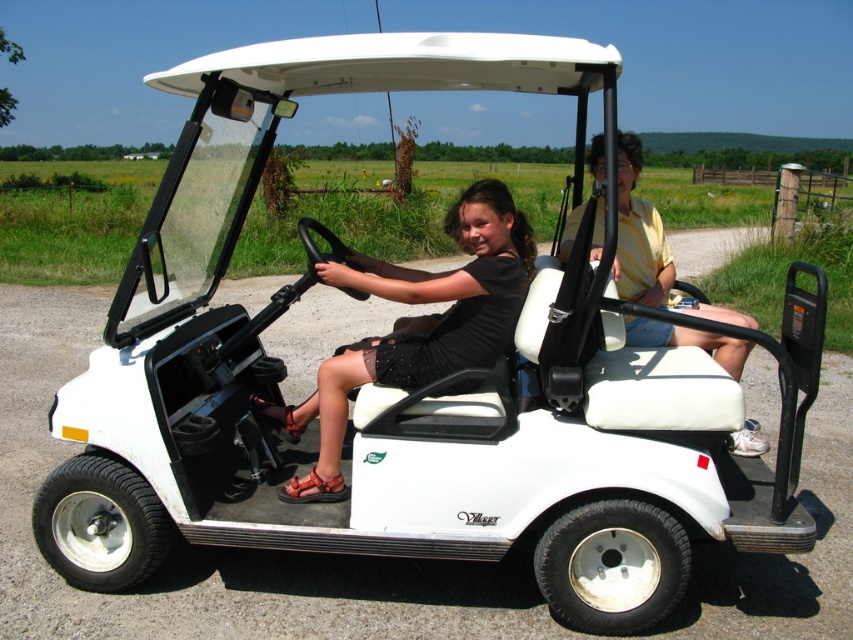
Question: Can you confirm if black matte dress at center is thinner than white leather seat at center?

Choices:
 (A) yes
 (B) no

Answer: (B)

Question: Can you confirm if black matte dress at center is positioned below white leather seat at center?

Choices:
 (A) no
 (B) yes

Answer: (B)

Question: Considering the relative positions of black matte dress at center and white leather seat at center in the image provided, where is black matte dress at center located with respect to white leather seat at center?

Choices:
 (A) right
 (B) left

Answer: (B)

Question: Which point is closer to the camera?

Choices:
 (A) black matte dress at center
 (B) white leather seat at center

Answer: (B)

Question: Which point is farther to the camera?

Choices:
 (A) black matte dress at center
 (B) white leather seat at center

Answer: (A)

Question: Which of the following is the farthest from the observer?

Choices:
 (A) (479, 280)
 (B) (627, 268)

Answer: (B)